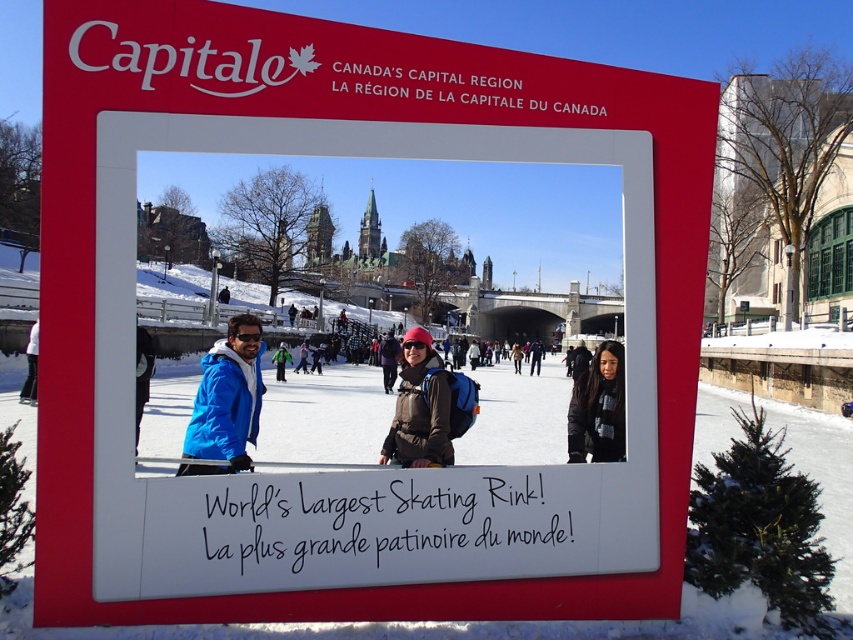
Consider the image. Does brown matte jacket at center have a greater width compared to blue fabric jacket at left?

No.

Does point (413, 451) come behind point (148, 365)?

No, (413, 451) is in front of (148, 365).

Is point (415, 460) positioned after point (144, 328)?

No, (415, 460) is closer to viewer.

You are a GUI agent. You are given a task and a screenshot of the screen. Output one action in this format:
    pyautogui.click(x=<x>, y=<y>)
    Task: Click on the brown matte jacket at center
    This screenshot has width=853, height=640.
    Given the screenshot: What is the action you would take?
    pyautogui.click(x=419, y=406)

Does green snowsuit at center have a smaller size compared to blue jacket at center?

No.

Who is shorter, green snowsuit at center or blue jacket at center?

Standing shorter between the two is green snowsuit at center.

Between point (285, 346) and point (294, 369), which one is positioned behind?

Point (285, 346)

I want to click on green snowsuit at center, so click(x=280, y=360).

Does blue fabric jacket at left appear on the right side of green snowsuit at center?

Incorrect, blue fabric jacket at left is not on the right side of green snowsuit at center.

Identify the location of blue fabric jacket at left. The height and width of the screenshot is (640, 853). pyautogui.click(x=142, y=374).

Where is `blue fabric jacket at left`? blue fabric jacket at left is located at coordinates (142, 374).